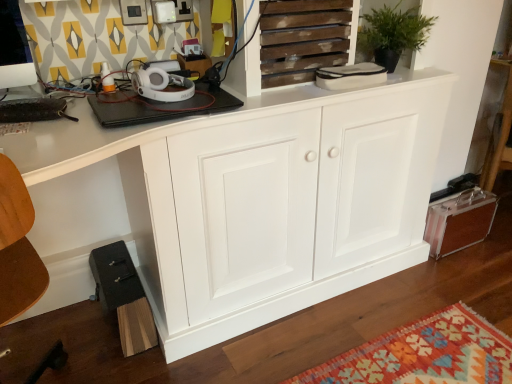
What is the approximate height of metallic brown suitcase at lower right, which is counted as the 2th cabinetry, starting from the left?

metallic brown suitcase at lower right, which is counted as the 2th cabinetry, starting from the left, is 10.45 inches tall.

What are the coordinates of `white wood cabinet at center, which ranks as the 2th cabinetry in right-to-left order` in the screenshot? It's located at (265, 198).

You are a GUI agent. You are given a task and a screenshot of the screen. Output one action in this format:
    pyautogui.click(x=<x>, y=<y>)
    Task: Click on the metallic brown suitcase at lower right, which appears as the first cabinetry when viewed from the right
    
    Given the screenshot: What is the action you would take?
    459,221

Relative to wooden slats at upper center, is white wood cabinet at center, the first cabinetry when ordered from left to right, in front or behind?

white wood cabinet at center, the first cabinetry when ordered from left to right, is positioned closer to the viewer than wooden slats at upper center.

Image resolution: width=512 pixels, height=384 pixels. I want to click on cabinetry in front of the wooden slats at upper center, so click(x=265, y=198).

Between white wood cabinet at center, the first cabinetry when ordered from left to right, and wooden slats at upper center, which one has larger size?

Bigger between the two is white wood cabinet at center, the first cabinetry when ordered from left to right.

From a real-world perspective, is white wood cabinet at center, which ranks as the 2th cabinetry in right-to-left order, physically below wooden slats at upper center?

Yes, from a real-world perspective, white wood cabinet at center, which ranks as the 2th cabinetry in right-to-left order, is under wooden slats at upper center.

This screenshot has width=512, height=384. What are the coordinates of `houseplant behind the white wood cabinet at center, which ranks as the 2th cabinetry in right-to-left order` in the screenshot? It's located at (392, 33).

Between green matte plant at upper center and white wood cabinet at center, the first cabinetry when ordered from left to right, which one has more height?

Standing taller between the two is white wood cabinet at center, the first cabinetry when ordered from left to right.

From a real-world perspective, is green matte plant at upper center above or below white wood cabinet at center, the first cabinetry when ordered from left to right?

From a real-world perspective, green matte plant at upper center is physically above white wood cabinet at center, the first cabinetry when ordered from left to right.

From the image's perspective, is green matte plant at upper center positioned above or below white wood cabinet at center, the first cabinetry when ordered from left to right?

From the image's perspective, green matte plant at upper center appears above white wood cabinet at center, the first cabinetry when ordered from left to right.

Considering the sizes of objects white wood cabinet at center, the first cabinetry when ordered from left to right, and metallic brown suitcase at lower right, which appears as the first cabinetry when viewed from the right, in the image provided, who is taller, white wood cabinet at center, the first cabinetry when ordered from left to right, or metallic brown suitcase at lower right, which appears as the first cabinetry when viewed from the right,?

With more height is white wood cabinet at center, the first cabinetry when ordered from left to right.

Is white wood cabinet at center, the first cabinetry when ordered from left to right, smaller than metallic brown suitcase at lower right, which appears as the first cabinetry when viewed from the right?

No, white wood cabinet at center, the first cabinetry when ordered from left to right, is not smaller than metallic brown suitcase at lower right, which appears as the first cabinetry when viewed from the right.

The image size is (512, 384). I want to click on cabinetry on the right of the white wood cabinet at center, which ranks as the 2th cabinetry in right-to-left order, so click(x=459, y=221).

Consider the image. Based on their sizes in the image, would you say wooden slats at upper center is bigger or smaller than green matte plant at upper center?

Clearly, wooden slats at upper center is smaller in size than green matte plant at upper center.

What are the coordinates of `houseplant that is above the wooden slats at upper center (from the image's perspective)` in the screenshot? It's located at (392, 33).

Looking at this image, is wooden slats at upper center at the left side of green matte plant at upper center?

Correct, you'll find wooden slats at upper center to the left of green matte plant at upper center.

Is point (309, 6) less distant than point (368, 19)?

That is True.

Between metallic brown suitcase at lower right, which appears as the first cabinetry when viewed from the right, and white wood cabinet at center, which ranks as the 2th cabinetry in right-to-left order, which one has smaller width?

With smaller width is metallic brown suitcase at lower right, which appears as the first cabinetry when viewed from the right.

How many degrees apart are the facing directions of metallic brown suitcase at lower right, which appears as the first cabinetry when viewed from the right, and white wood cabinet at center, which ranks as the 2th cabinetry in right-to-left order?

1.07 degrees separate the facing orientations of metallic brown suitcase at lower right, which appears as the first cabinetry when viewed from the right, and white wood cabinet at center, which ranks as the 2th cabinetry in right-to-left order.

Between metallic brown suitcase at lower right, which appears as the first cabinetry when viewed from the right, and white wood cabinet at center, the first cabinetry when ordered from left to right, which one appears on the right side from the viewer's perspective?

From the viewer's perspective, metallic brown suitcase at lower right, which appears as the first cabinetry when viewed from the right, appears more on the right side.

From the picture: Is metallic brown suitcase at lower right, which appears as the first cabinetry when viewed from the right, bigger than white wood cabinet at center, which ranks as the 2th cabinetry in right-to-left order?

Incorrect, metallic brown suitcase at lower right, which appears as the first cabinetry when viewed from the right, is not larger than white wood cabinet at center, which ranks as the 2th cabinetry in right-to-left order.

In terms of size, does green matte plant at upper center appear bigger or smaller than metallic brown suitcase at lower right, which is counted as the 2th cabinetry, starting from the left?

Considering their sizes, green matte plant at upper center takes up more space than metallic brown suitcase at lower right, which is counted as the 2th cabinetry, starting from the left.

Is point (372, 30) positioned after point (432, 229)?

No, (372, 30) is in front of (432, 229).

From a real-world perspective, which object stands above the other?

In real-world perspective, green matte plant at upper center is above.

Find the location of a particular element. The height and width of the screenshot is (384, 512). houseplant that is in front of the metallic brown suitcase at lower right, which is counted as the 2th cabinetry, starting from the left is located at coordinates (392, 33).

Considering the relative sizes of metallic brown suitcase at lower right, which is counted as the 2th cabinetry, starting from the left, and wooden slats at upper center in the image provided, is metallic brown suitcase at lower right, which is counted as the 2th cabinetry, starting from the left, smaller than wooden slats at upper center?

Yes.

Locate an element on the screen. cupboard located in front of the metallic brown suitcase at lower right, which appears as the first cabinetry when viewed from the right is located at coordinates (295, 43).

In the scene shown: Would you say metallic brown suitcase at lower right, which appears as the first cabinetry when viewed from the right, contains wooden slats at upper center?

No, wooden slats at upper center is not inside metallic brown suitcase at lower right, which appears as the first cabinetry when viewed from the right.

Identify the location of cupboard above the white wood cabinet at center, which ranks as the 2th cabinetry in right-to-left order (from the image's perspective). This screenshot has width=512, height=384. (295, 43).

The width and height of the screenshot is (512, 384). Find the location of `cabinetry lying on the left of green matte plant at upper center`. cabinetry lying on the left of green matte plant at upper center is located at coordinates (265, 198).

Based on their spatial positions, is green matte plant at upper center or white wood cabinet at center, the first cabinetry when ordered from left to right, closer to metallic brown suitcase at lower right, which appears as the first cabinetry when viewed from the right?

Based on the image, white wood cabinet at center, the first cabinetry when ordered from left to right, appears to be nearer to metallic brown suitcase at lower right, which appears as the first cabinetry when viewed from the right.

Based on their spatial positions, is wooden slats at upper center or metallic brown suitcase at lower right, which appears as the first cabinetry when viewed from the right, closer to green matte plant at upper center?

wooden slats at upper center lies closer to green matte plant at upper center than the other object.

From the image, which object appears to be farther from white wood cabinet at center, the first cabinetry when ordered from left to right, green matte plant at upper center or metallic brown suitcase at lower right, which appears as the first cabinetry when viewed from the right?

Among the two, metallic brown suitcase at lower right, which appears as the first cabinetry when viewed from the right, is located further to white wood cabinet at center, the first cabinetry when ordered from left to right.

Considering their positions, is green matte plant at upper center positioned closer to wooden slats at upper center than metallic brown suitcase at lower right, which appears as the first cabinetry when viewed from the right?

Based on the image, green matte plant at upper center appears to be nearer to wooden slats at upper center.

Looking at the image, which one is located closer to green matte plant at upper center, white wood cabinet at center, the first cabinetry when ordered from left to right, or metallic brown suitcase at lower right, which appears as the first cabinetry when viewed from the right?

white wood cabinet at center, the first cabinetry when ordered from left to right.

Which object lies nearer to the anchor point metallic brown suitcase at lower right, which appears as the first cabinetry when viewed from the right, wooden slats at upper center or white wood cabinet at center, the first cabinetry when ordered from left to right?

white wood cabinet at center, the first cabinetry when ordered from left to right.

Looking at the image, which one is located closer to white wood cabinet at center, the first cabinetry when ordered from left to right, metallic brown suitcase at lower right, which is counted as the 2th cabinetry, starting from the left, or wooden slats at upper center?

wooden slats at upper center is closer to white wood cabinet at center, the first cabinetry when ordered from left to right.

Based on their spatial positions, is wooden slats at upper center or green matte plant at upper center closer to white wood cabinet at center, which ranks as the 2th cabinetry in right-to-left order?

wooden slats at upper center.

Identify the location of houseplant between white wood cabinet at center, the first cabinetry when ordered from left to right, and metallic brown suitcase at lower right, which appears as the first cabinetry when viewed from the right, in the front-back direction. (392, 33).

This screenshot has height=384, width=512. What are the coordinates of `houseplant situated between wooden slats at upper center and metallic brown suitcase at lower right, which appears as the first cabinetry when viewed from the right, from left to right` in the screenshot? It's located at (392, 33).

In order to click on cupboard positioned between white wood cabinet at center, the first cabinetry when ordered from left to right, and green matte plant at upper center from near to far in this screenshot , I will do `click(295, 43)`.

Find the location of a particular element. This screenshot has width=512, height=384. cupboard between white wood cabinet at center, which ranks as the 2th cabinetry in right-to-left order, and metallic brown suitcase at lower right, which is counted as the 2th cabinetry, starting from the left, in the front-back direction is located at coordinates (295, 43).